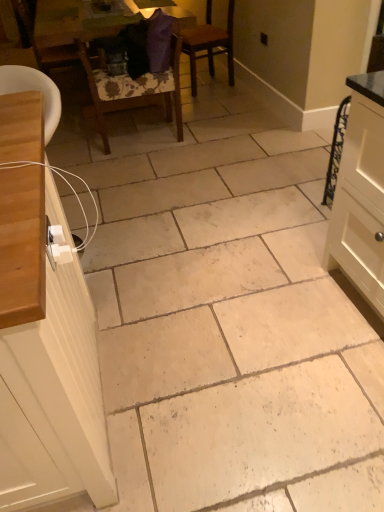
At what (x,y) coordinates should I click in order to perform the action: click on free area in between white matte cabinet at left and wooden chair at center, the 2th chair in the left-to-right sequence. Please return your answer as a coordinate pair (x, y). The width and height of the screenshot is (384, 512). Looking at the image, I should click on (137, 215).